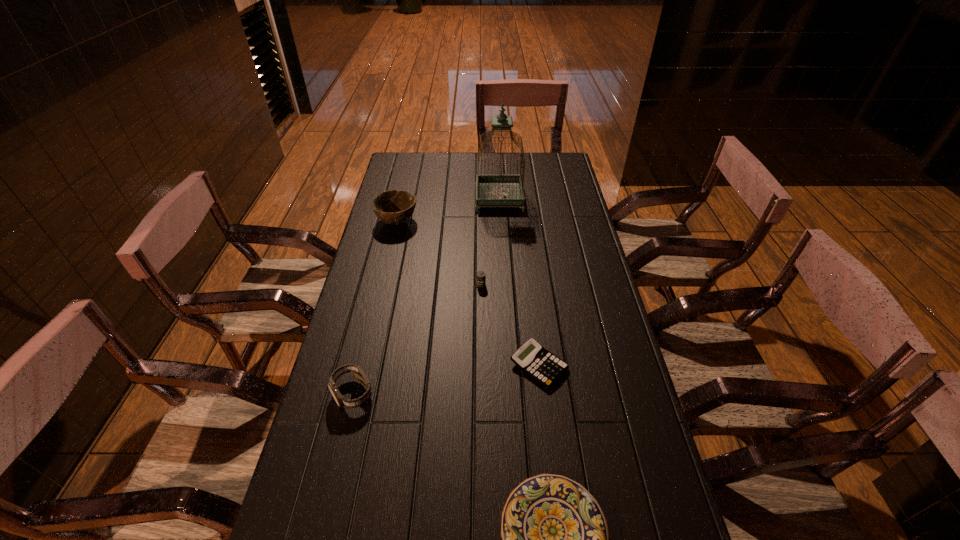
The height and width of the screenshot is (540, 960). I want to click on birdcage, so click(x=492, y=190).

Locate an element on the screen. The height and width of the screenshot is (540, 960). bowl is located at coordinates (393, 207).

Find the location of a particular element. the third tallest object is located at coordinates (357, 372).

Where is `the fourth tallest object`? the fourth tallest object is located at coordinates (480, 276).

Locate an element on the screen. beer can is located at coordinates (480, 276).

At what (x,y) coordinates should I click in order to perform the action: click on calculator. Please return your answer as a coordinate pair (x, y). Looking at the image, I should click on (532, 358).

The height and width of the screenshot is (540, 960). Find the location of `free location located 0.260m at the door of the tallest object`. free location located 0.260m at the door of the tallest object is located at coordinates (412, 198).

Find the location of a particular element. vacant area located at the door of the tallest object is located at coordinates (453, 198).

Locate an element on the screen. The width and height of the screenshot is (960, 540). vacant space located at the door of the tallest object is located at coordinates (396, 198).

Find the location of a particular element. The image size is (960, 540). vacant space situated on the back of the bowl is located at coordinates (410, 165).